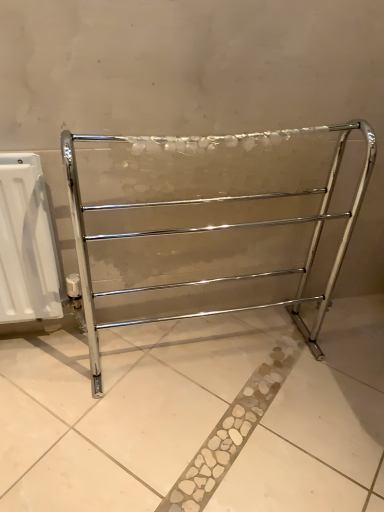
What is the approximate width of white plastic radiator at left?

The width of white plastic radiator at left is 3.78 inches.

Identify the location of white plastic radiator at left. (27, 244).

What do you see at coordinates (27, 244) in the screenshot? I see `white plastic radiator at left` at bounding box center [27, 244].

This screenshot has height=512, width=384. I want to click on polished chrome towel rack at center, so click(217, 226).

The height and width of the screenshot is (512, 384). What do you see at coordinates (217, 226) in the screenshot? I see `polished chrome towel rack at center` at bounding box center [217, 226].

I want to click on white plastic radiator at left, so pos(27,244).

Which object is positioned more to the right, polished chrome towel rack at center or white plastic radiator at left?

Positioned to the right is polished chrome towel rack at center.

Looking at this image, does polished chrome towel rack at center come in front of white plastic radiator at left?

→ That is True.

Considering the points (329, 172) and (18, 214), which point is in front, point (329, 172) or point (18, 214)?

Point (18, 214)

From the image's perspective, does polished chrome towel rack at center appear lower than white plastic radiator at left?

No.

From a real-world perspective, who is located lower, polished chrome towel rack at center or white plastic radiator at left?

white plastic radiator at left is physically lower.

Is polished chrome towel rack at center thinner than white plastic radiator at left?

No.

Considering the relative sizes of polished chrome towel rack at center and white plastic radiator at left in the image provided, is polished chrome towel rack at center shorter than white plastic radiator at left?

Incorrect, the height of polished chrome towel rack at center does not fall short of that of white plastic radiator at left.

Based on their sizes in the image, would you say polished chrome towel rack at center is bigger or smaller than white plastic radiator at left?

Considering their sizes, polished chrome towel rack at center takes up more space than white plastic radiator at left.

Which is correct: polished chrome towel rack at center is inside white plastic radiator at left, or outside of it?

polished chrome towel rack at center is not inside white plastic radiator at left, it's outside.

Is polished chrome towel rack at center with white plastic radiator at left?

No.

Is polished chrome towel rack at center facing towards white plastic radiator at left?

No.

Locate an element on the screen. radiator behind the polished chrome towel rack at center is located at coordinates (27, 244).

Is white plastic radiator at left to the left or to the right of polished chrome towel rack at center in the image?

white plastic radiator at left is to the left of polished chrome towel rack at center.

Which object is further away from the camera, white plastic radiator at left or polished chrome towel rack at center?

white plastic radiator at left.

Does point (37, 200) lie in front of point (106, 234)?

Yes.

From the image's perspective, which object appears higher, white plastic radiator at left or polished chrome towel rack at center?

polished chrome towel rack at center, from the image's perspective.

From a real-world perspective, which object stands above the other?

From a 3D spatial view, polished chrome towel rack at center is above.

Considering the sizes of objects white plastic radiator at left and polished chrome towel rack at center in the image provided, who is wider, white plastic radiator at left or polished chrome towel rack at center?

With larger width is polished chrome towel rack at center.

Which of these two, white plastic radiator at left or polished chrome towel rack at center, stands taller?

polished chrome towel rack at center.

Considering the relative sizes of white plastic radiator at left and polished chrome towel rack at center in the image provided, is white plastic radiator at left bigger than polished chrome towel rack at center?

Incorrect, white plastic radiator at left is not larger than polished chrome towel rack at center.

Choose the correct answer: Is white plastic radiator at left inside polished chrome towel rack at center or outside it?

white plastic radiator at left is spatially situated outside polished chrome towel rack at center.

Is white plastic radiator at left far away from polished chrome towel rack at center?

No, white plastic radiator at left is in close proximity to polished chrome towel rack at center.

Could you tell me if white plastic radiator at left is turned towards polished chrome towel rack at center?

No, white plastic radiator at left is not aimed at polished chrome towel rack at center.

What's the angular difference between white plastic radiator at left and polished chrome towel rack at center's facing directions?

There is a 2.96-degree angle between the facing directions of white plastic radiator at left and polished chrome towel rack at center.

Where is `radiator below the polished chrome towel rack at center (from the image's perspective)`? Image resolution: width=384 pixels, height=512 pixels. radiator below the polished chrome towel rack at center (from the image's perspective) is located at coordinates (27, 244).

Find the location of `radiator below the polished chrome towel rack at center (from the image's perspective)`. radiator below the polished chrome towel rack at center (from the image's perspective) is located at coordinates (27, 244).

Locate an element on the screen. radiator that appears below the polished chrome towel rack at center (from a real-world perspective) is located at coordinates (27, 244).